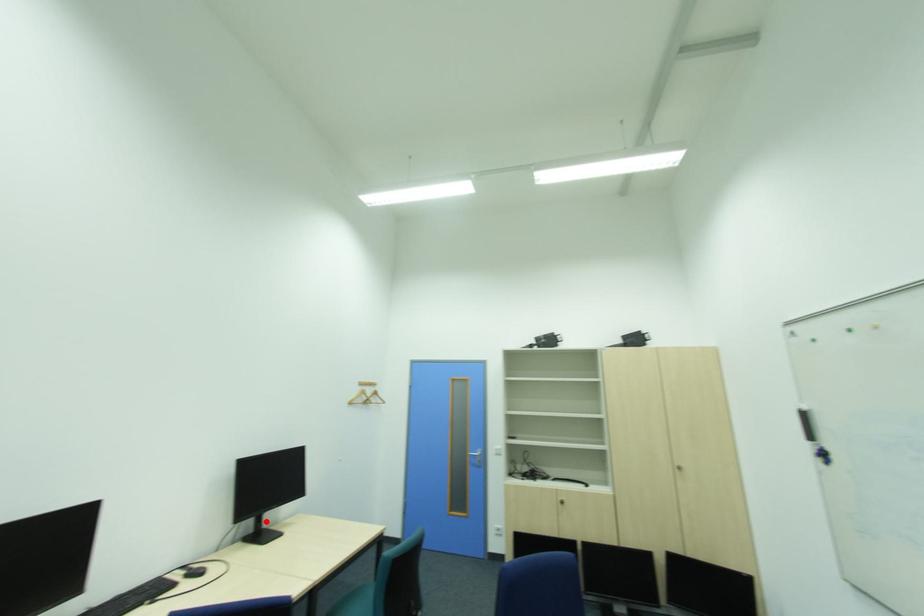
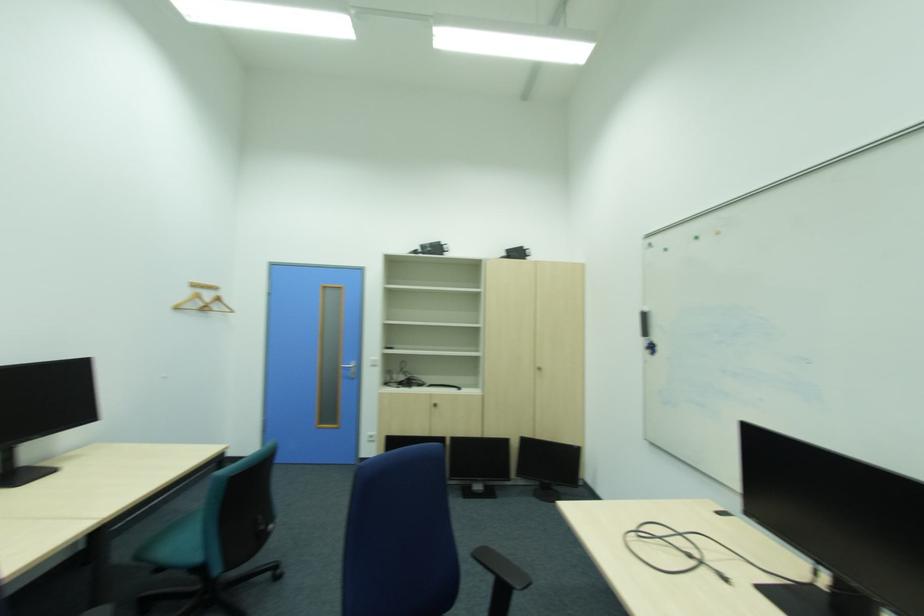
Where in the second image is the point corresponding to the highlighted location from the first image?

(13, 459)